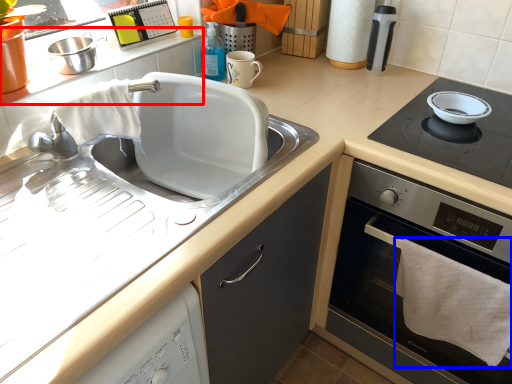
Question: Which of the following is the closest to the observer, counter top (highlighted by a red box) or bath towel (highlighted by a blue box)?

Choices:
 (A) counter top
 (B) bath towel

Answer: (B)